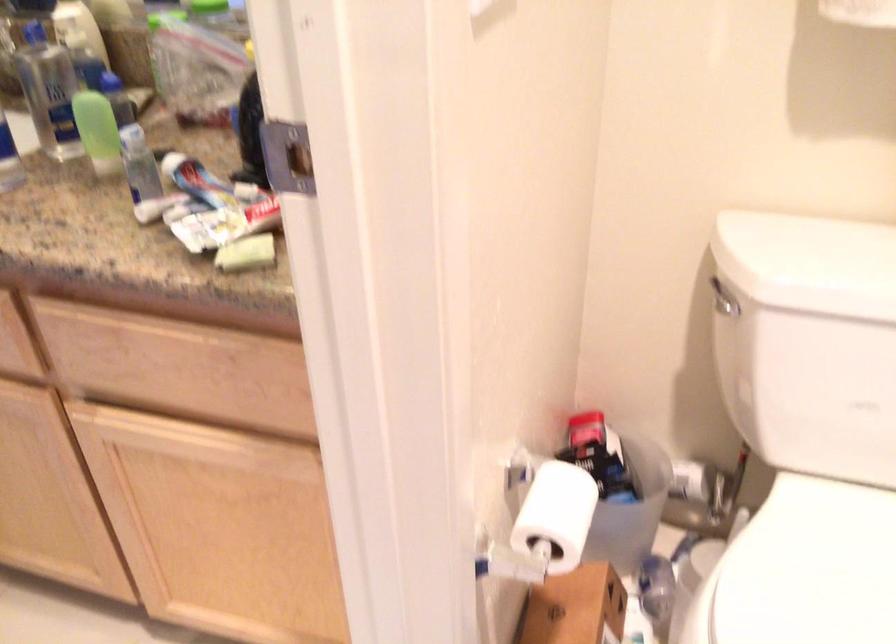
At what (x,y) coordinates should I click in order to perform the action: click on drawer finger pull. Please return your answer as a coordinate pair (x, y). Looking at the image, I should click on (177, 368).